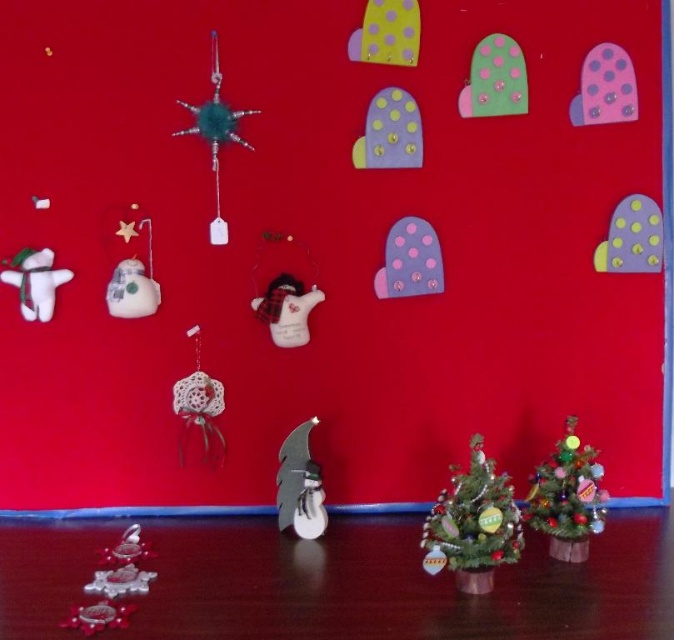
Is point (313, 492) farther from viewer compared to point (200, 436)?

No, (313, 492) is closer to viewer.

Which of these two, wooden snowman at center or white lace ornament at center-left, stands shorter?

With less height is wooden snowman at center.

Measure the distance between point (309, 518) and camera.

4.35 feet

Identify the location of wooden snowman at center. Image resolution: width=674 pixels, height=640 pixels. (299, 484).

Can you confirm if wooden snowman at center is smaller than purple felt mitten at upper right?

No, wooden snowman at center is not smaller than purple felt mitten at upper right.

Which is more to the left, wooden snowman at center or purple felt mitten at upper right?

wooden snowman at center is more to the left.

Measure the distance between point (282, 445) and camera.

4.48 feet

Find the location of a particular element. wooden snowman at center is located at coordinates [299, 484].

Is green felt mittens at upper center behind teal glitter star at upper left?

Yes.

Is point (474, 72) closer to viewer compared to point (193, 115)?

No, (474, 72) is further to viewer.

Where is `green felt mittens at upper center`? green felt mittens at upper center is located at coordinates (493, 80).